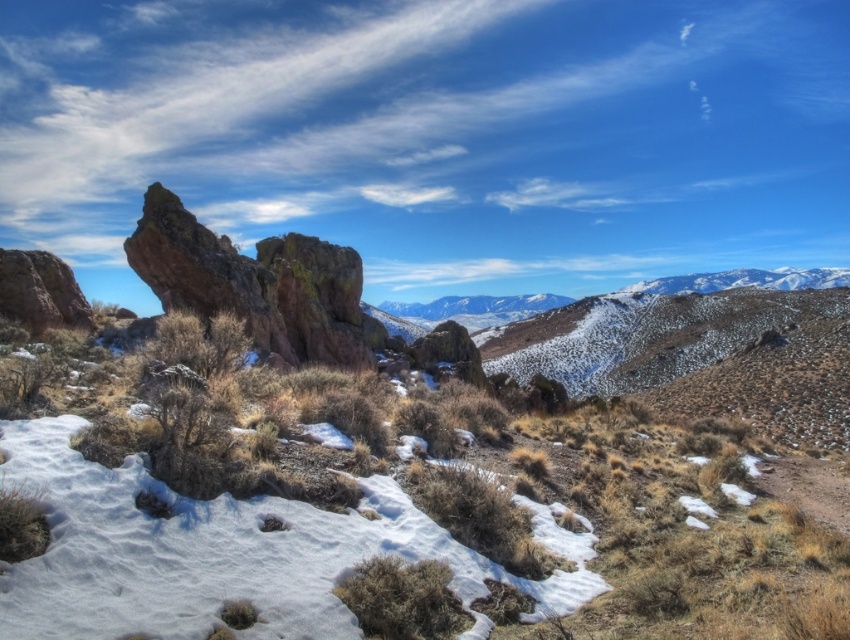
You are a hiker standing at the base of the rustic rock formation at center. You want to place a 2.5 meter long tent on the ground in front of the rock formation. Is there enough space between you and the rock formation to set up the tent?

The rustic rock formation at center is 10.38 meters away from the viewer. Since the tent is only 2.5 meters long, there is sufficient space to set it up in front of the rock formation.

You are a hiker standing at the point marked by the coordinates point (435, 481) in the rugged mountainous landscape. What is the most prominent feature directly beneath your feet?

The point (435, 481) marks the rustic rock formation at center, so the most prominent feature directly beneath your feet is the rustic rock formation at center.